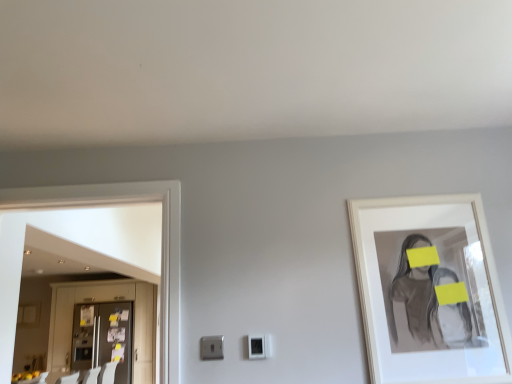
Question: In the image, is metallic refrigerator at left on the left side or the right side of white plastic electric outlet at center?

Choices:
 (A) left
 (B) right

Answer: (A)

Question: In terms of size, does metallic refrigerator at left appear bigger or smaller than white plastic electric outlet at center?

Choices:
 (A) big
 (B) small

Answer: (A)

Question: Which of these objects is positioned closest to the white matte picture frame at upper right?

Choices:
 (A) metallic refrigerator at left
 (B) white plastic electric outlet at center
 (C) matte gray cabinetry at left

Answer: (B)

Question: Estimate the real-world distances between objects in this image. Which object is farther from the white plastic electric outlet at center?

Choices:
 (A) matte gray cabinetry at left
 (B) white matte picture frame at upper right
 (C) metallic refrigerator at left

Answer: (C)